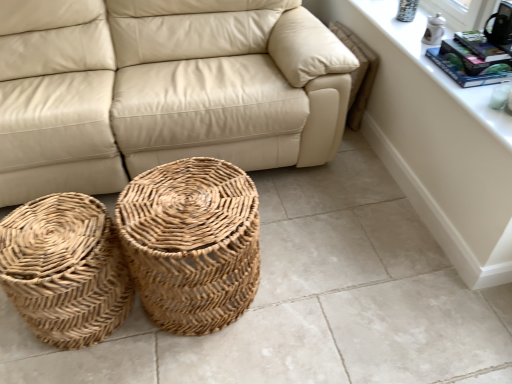
Image resolution: width=512 pixels, height=384 pixels. Find the location of `free location above natural woven basket at center, which appears as the 1th basket when viewed from the right (from a real-world perspective)`. free location above natural woven basket at center, which appears as the 1th basket when viewed from the right (from a real-world perspective) is located at coordinates (182, 203).